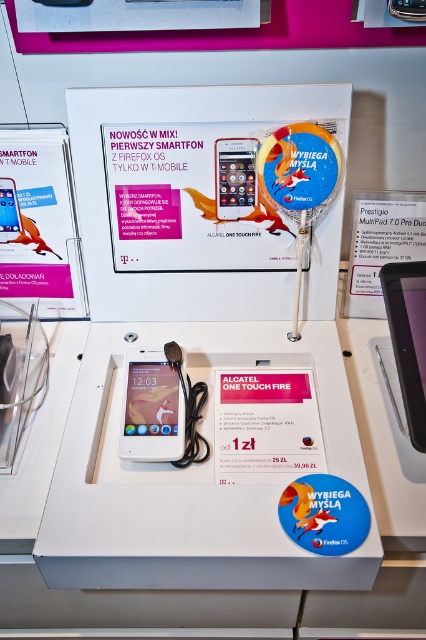
Question: Which of these objects is positioned farthest from the white glossy ipod at center?

Choices:
 (A) black glossy tablet at upper right
 (B) matte white ipod touch at center

Answer: (A)

Question: Considering the relative positions of black glossy tablet at upper right and matte white ipod touch at center in the image provided, where is black glossy tablet at upper right located with respect to matte white ipod touch at center?

Choices:
 (A) below
 (B) above

Answer: (A)

Question: Observing the image, what is the correct spatial positioning of white glossy ipod at center in reference to matte white ipod touch at center?

Choices:
 (A) right
 (B) left

Answer: (B)

Question: Which is farther from the black glossy tablet at upper right?

Choices:
 (A) matte white ipod touch at center
 (B) white glossy ipod at center

Answer: (B)

Question: Does white glossy ipod at center have a lesser width compared to black glossy tablet at upper right?

Choices:
 (A) yes
 (B) no

Answer: (B)

Question: Among these points, which one is farthest from the camera?

Choices:
 (A) (414, 396)
 (B) (172, 432)

Answer: (A)